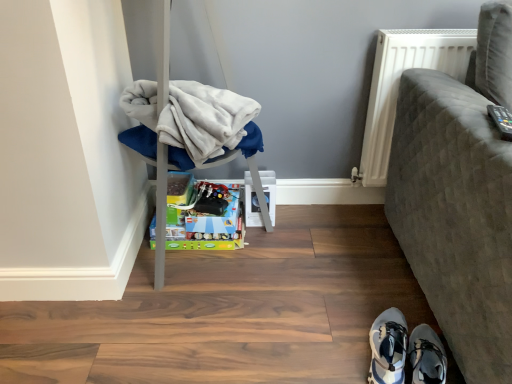
Consider the image. What is the approximate height of light blue fabric shoe at lower right, which is the 2th footwear from right to left?

The height of light blue fabric shoe at lower right, which is the 2th footwear from right to left, is 4.47 inches.

Describe the element at coordinates (388, 348) in the screenshot. I see `light blue fabric shoe at lower right, which is the 2th footwear from right to left` at that location.

Where is `soft gray fabric chair at left, which is counted as the 1th furniture, starting from the left`? soft gray fabric chair at left, which is counted as the 1th furniture, starting from the left is located at coordinates click(x=191, y=125).

The image size is (512, 384). In order to click on white synthetic sneakers at lower right, the second footwear positioned from the left in this screenshot , I will do `click(426, 356)`.

Identify the location of light blue fabric shoe at lower right, which is the 2th footwear from right to left. This screenshot has height=384, width=512. (388, 348).

From the picture: What's the angular difference between textured gray sofa at right, the 1th furniture positioned from the right, and white synthetic sneakers at lower right, which is the 1th footwear in right-to-left order,'s facing directions?

The angular difference between textured gray sofa at right, the 1th furniture positioned from the right, and white synthetic sneakers at lower right, which is the 1th footwear in right-to-left order, is 159 degrees.

Is textured gray sofa at right, which is counted as the second furniture, starting from the left, taller or shorter than white synthetic sneakers at lower right, the second footwear positioned from the left?

Clearly, textured gray sofa at right, which is counted as the second furniture, starting from the left, is taller compared to white synthetic sneakers at lower right, the second footwear positioned from the left.

From a real-world perspective, which is physically below, textured gray sofa at right, which is counted as the second furniture, starting from the left, or white synthetic sneakers at lower right, the second footwear positioned from the left?

white synthetic sneakers at lower right, the second footwear positioned from the left, is physically lower.

Is textured gray sofa at right, the 1th furniture positioned from the right, in front of white synthetic sneakers at lower right, which is the 1th footwear in right-to-left order?

Yes, it is.

What's the angular difference between white fleece blanket at left and textured gray sofa at right, the 1th furniture positioned from the right,'s facing directions?

0.616 degrees separate the facing orientations of white fleece blanket at left and textured gray sofa at right, the 1th furniture positioned from the right.

From their relative heights in the image, would you say white fleece blanket at left is taller or shorter than textured gray sofa at right, which is counted as the second furniture, starting from the left?

Considering their sizes, white fleece blanket at left has less height than textured gray sofa at right, which is counted as the second furniture, starting from the left.

From the picture: Considering the sizes of objects white fleece blanket at left and textured gray sofa at right, the 1th furniture positioned from the right, in the image provided, who is smaller, white fleece blanket at left or textured gray sofa at right, the 1th furniture positioned from the right,?

Smaller between the two is white fleece blanket at left.

From a real-world perspective, is white fleece blanket at left physically located above or below textured gray sofa at right, the 1th furniture positioned from the right?

Clearly, from a real-world perspective, white fleece blanket at left is above textured gray sofa at right, the 1th furniture positioned from the right.

Considering the sizes of objects white synthetic sneakers at lower right, the second footwear positioned from the left, and textured gray sofa at right, the 1th furniture positioned from the right, in the image provided, who is thinner, white synthetic sneakers at lower right, the second footwear positioned from the left, or textured gray sofa at right, the 1th furniture positioned from the right,?

white synthetic sneakers at lower right, the second footwear positioned from the left.

Is white synthetic sneakers at lower right, the second footwear positioned from the left, directly adjacent to textured gray sofa at right, which is counted as the second furniture, starting from the left?

white synthetic sneakers at lower right, the second footwear positioned from the left, is not next to textured gray sofa at right, which is counted as the second furniture, starting from the left, and they're not touching.

Is white synthetic sneakers at lower right, which is the 1th footwear in right-to-left order, spatially inside textured gray sofa at right, which is counted as the second furniture, starting from the left, or outside of it?

white synthetic sneakers at lower right, which is the 1th footwear in right-to-left order, is not enclosed by textured gray sofa at right, which is counted as the second furniture, starting from the left.

Is point (413, 366) closer or farther from the camera than point (464, 155)?

Clearly, point (413, 366) is more distant from the camera than point (464, 155).

Is soft gray fabric chair at left, placed as the 2th furniture when sorted from right to left, placed right next to shiny metallic toy at center?

There is a gap between soft gray fabric chair at left, placed as the 2th furniture when sorted from right to left, and shiny metallic toy at center.

Does soft gray fabric chair at left, which is counted as the 1th furniture, starting from the left, come behind shiny metallic toy at center?

That is False.

Is soft gray fabric chair at left, which is counted as the 1th furniture, starting from the left, wider than shiny metallic toy at center?

Yes.

How different are the orientations of shiny metallic toy at center and soft gray fabric chair at left, placed as the 2th furniture when sorted from right to left, in degrees?

93.5 degrees separate the facing orientations of shiny metallic toy at center and soft gray fabric chair at left, placed as the 2th furniture when sorted from right to left.

Does point (227, 190) come farther from viewer compared to point (255, 104)?

Yes.

Does shiny metallic toy at center turn towards soft gray fabric chair at left, which is counted as the 1th furniture, starting from the left?

Yes, shiny metallic toy at center faces towards soft gray fabric chair at left, which is counted as the 1th furniture, starting from the left.

Is shiny metallic toy at center closer to the viewer compared to soft gray fabric chair at left, placed as the 2th furniture when sorted from right to left?

No, the depth of shiny metallic toy at center is greater than that of soft gray fabric chair at left, placed as the 2th furniture when sorted from right to left.

Is light blue fabric shoe at lower right, the first footwear viewed from the left, turned away from white textured radiator at upper right?

That's not correct — light blue fabric shoe at lower right, the first footwear viewed from the left, is not looking away from white textured radiator at upper right.

Consider the image. Considering the sizes of light blue fabric shoe at lower right, the first footwear viewed from the left, and white textured radiator at upper right in the image, is light blue fabric shoe at lower right, the first footwear viewed from the left, taller or shorter than white textured radiator at upper right?

Considering their sizes, light blue fabric shoe at lower right, the first footwear viewed from the left, has less height than white textured radiator at upper right.

At what (x,y) coordinates should I click in order to perform the action: click on radiator behind the light blue fabric shoe at lower right, which is the 2th footwear from right to left. Please return your answer as a coordinate pair (x, y). The width and height of the screenshot is (512, 384). Looking at the image, I should click on (398, 85).

How far apart are light blue fabric shoe at lower right, which is the 2th footwear from right to left, and white textured radiator at upper right?

light blue fabric shoe at lower right, which is the 2th footwear from right to left, is 31.79 inches from white textured radiator at upper right.

Does white synthetic sneakers at lower right, the second footwear positioned from the left, appear on the right side of soft gray fabric chair at left, which is counted as the 1th furniture, starting from the left?

Yes.

Considering the relative sizes of white synthetic sneakers at lower right, which is the 1th footwear in right-to-left order, and soft gray fabric chair at left, which is counted as the 1th furniture, starting from the left, in the image provided, is white synthetic sneakers at lower right, which is the 1th footwear in right-to-left order, smaller than soft gray fabric chair at left, which is counted as the 1th furniture, starting from the left,?

Yes, white synthetic sneakers at lower right, which is the 1th footwear in right-to-left order, is smaller than soft gray fabric chair at left, which is counted as the 1th furniture, starting from the left.

Which object is more forward, white synthetic sneakers at lower right, the second footwear positioned from the left, or soft gray fabric chair at left, placed as the 2th furniture when sorted from right to left?

Positioned in front is white synthetic sneakers at lower right, the second footwear positioned from the left.

Is point (418, 331) farther from camera compared to point (197, 117)?

No, it is not.

The height and width of the screenshot is (384, 512). I want to click on the 1st footwear behind the textured gray sofa at right, which is counted as the second furniture, starting from the left, starting your count from the anchor, so click(x=426, y=356).

Identify the location of clothing on the left of textured gray sofa at right, which is counted as the second furniture, starting from the left. (191, 122).

Considering their positions, is white fleece blanket at left positioned closer to light blue fabric shoe at lower right, which is the 2th footwear from right to left, than soft gray fabric chair at left, which is counted as the 1th furniture, starting from the left?

white fleece blanket at left.

Looking at the image, which one is located closer to light blue fabric shoe at lower right, which is the 2th footwear from right to left, white fleece blanket at left or white textured radiator at upper right?

Among the two, white fleece blanket at left is located nearer to light blue fabric shoe at lower right, which is the 2th footwear from right to left.

In the scene shown: Looking at the image, which one is located closer to soft gray fabric chair at left, placed as the 2th furniture when sorted from right to left, white synthetic sneakers at lower right, the second footwear positioned from the left, or white fleece blanket at left?

white fleece blanket at left is positioned closer to the anchor soft gray fabric chair at left, placed as the 2th furniture when sorted from right to left.

From the image, which object appears to be farther from shiny metallic toy at center, soft gray fabric chair at left, which is counted as the 1th furniture, starting from the left, or light blue fabric shoe at lower right, the first footwear viewed from the left?

light blue fabric shoe at lower right, the first footwear viewed from the left, is positioned further to the anchor shiny metallic toy at center.

In the scene shown: Which object lies nearer to the anchor point white fleece blanket at left, white synthetic sneakers at lower right, the second footwear positioned from the left, or white textured radiator at upper right?

white textured radiator at upper right is closer to white fleece blanket at left.

Based on their spatial positions, is shiny metallic toy at center or textured gray sofa at right, which is counted as the second furniture, starting from the left, further from soft gray fabric chair at left, placed as the 2th furniture when sorted from right to left?

Among the two, textured gray sofa at right, which is counted as the second furniture, starting from the left, is located further to soft gray fabric chair at left, placed as the 2th furniture when sorted from right to left.

Looking at the image, which one is located closer to white textured radiator at upper right, white synthetic sneakers at lower right, which is the 1th footwear in right-to-left order, or shiny metallic toy at center?

The object closer to white textured radiator at upper right is shiny metallic toy at center.

Estimate the real-world distances between objects in this image. Which object is further from shiny metallic toy at center, white fleece blanket at left or white synthetic sneakers at lower right, the second footwear positioned from the left?

Based on the image, white synthetic sneakers at lower right, the second footwear positioned from the left, appears to be further to shiny metallic toy at center.

Locate an element on the screen. This screenshot has width=512, height=384. footwear that lies between white textured radiator at upper right and white synthetic sneakers at lower right, which is the 1th footwear in right-to-left order, from top to bottom is located at coordinates 388,348.

This screenshot has height=384, width=512. In order to click on furniture located between white fleece blanket at left and textured gray sofa at right, which is counted as the second furniture, starting from the left, in the left-right direction in this screenshot , I will do `click(191, 125)`.

Identify the location of furniture located between shiny metallic toy at center and white textured radiator at upper right in the left-right direction. The width and height of the screenshot is (512, 384). (191, 125).

The height and width of the screenshot is (384, 512). I want to click on footwear between soft gray fabric chair at left, placed as the 2th furniture when sorted from right to left, and white synthetic sneakers at lower right, which is the 1th footwear in right-to-left order, in the vertical direction, so click(x=388, y=348).